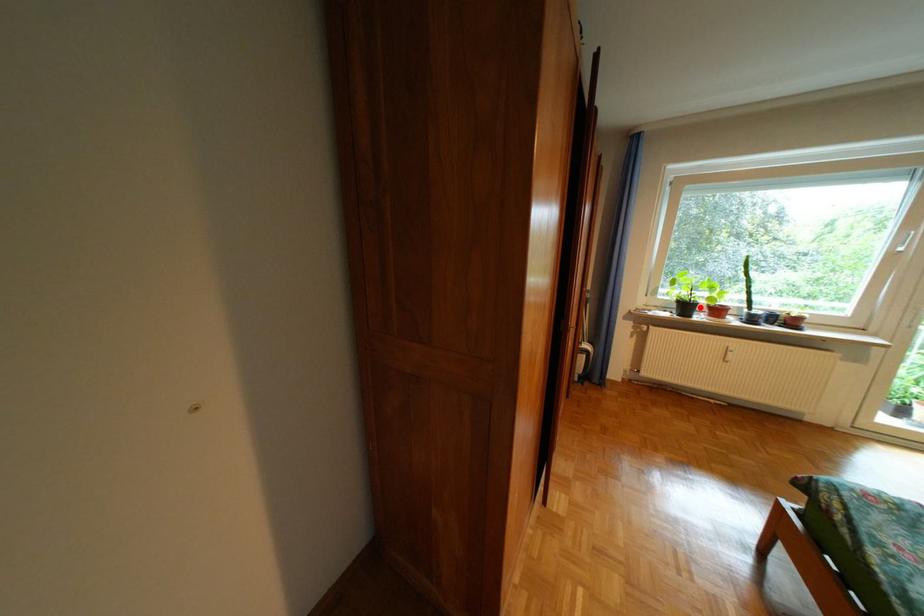
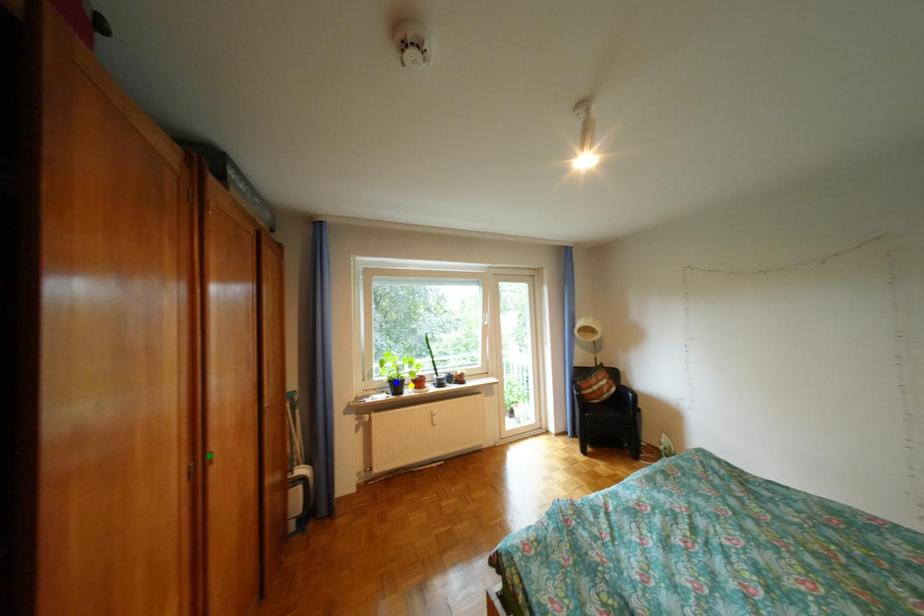
Question: I am providing you with two images of the same scene from different viewpoints. A red point is marked on the first image. You are given multiple points on the second image. Can you choose the point in image 2 that corresponds to the point in image 1?

Choices:
 (A) yellow point
 (B) green point
 (C) blue point

Answer: (A)